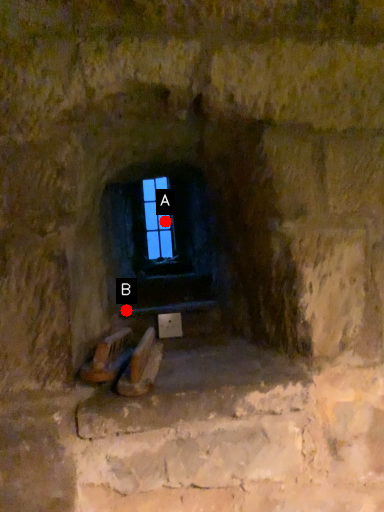
Question: Two points are circled on the image, labeled by A and B beside each circle. Which of the following is the farthest from the observer?

Choices:
 (A) A is further
 (B) B is further

Answer: (A)